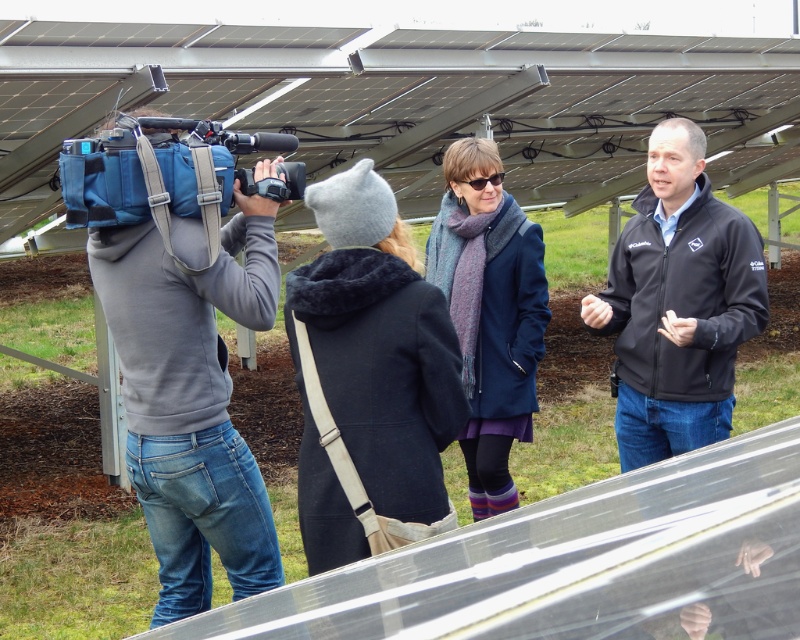
Between point (396, 419) and point (470, 252), which one is positioned behind?

The point (470, 252) is more distant.

Identify the location of dark blue wool coat at center. (370, 378).

Who is positioned more to the left, black matte camera at center or black plastic sunglasses at center?

From the viewer's perspective, black matte camera at center appears more on the left side.

Between point (304, 180) and point (456, 180), which one is positioned behind?

The point (456, 180) is more distant.

You are a GUI agent. You are given a task and a screenshot of the screen. Output one action in this format:
    pyautogui.click(x=<x>, y=<y>)
    Task: Click on the black matte camera at center
    The image size is (800, 640).
    Given the screenshot: What is the action you would take?
    pyautogui.click(x=274, y=182)

Find the location of `black matte camera at center`. black matte camera at center is located at coordinates (274, 182).

Is dark blue wool coat at center thinner than black matte camera at center?

Incorrect, dark blue wool coat at center's width is not less than black matte camera at center's.

Is dark blue wool coat at center in front of black matte camera at center?

Yes.

Identify the location of dark blue wool coat at center. (370, 378).